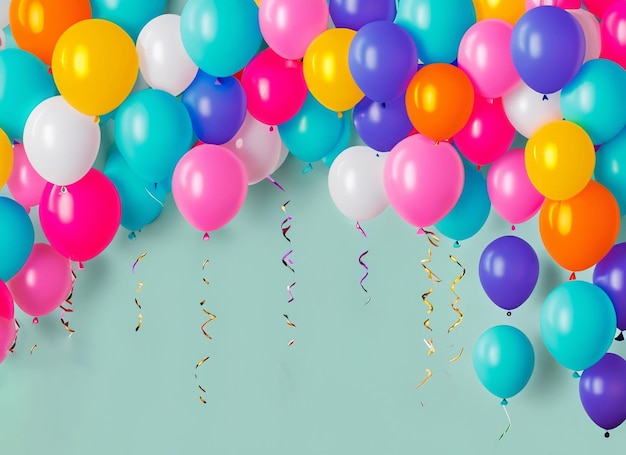
Locate an element on the screen. Image resolution: width=626 pixels, height=455 pixels. curling ribbons is located at coordinates (17, 342), (38, 330), (61, 314), (138, 267), (207, 262), (285, 195), (366, 241), (431, 253), (461, 274), (509, 415).